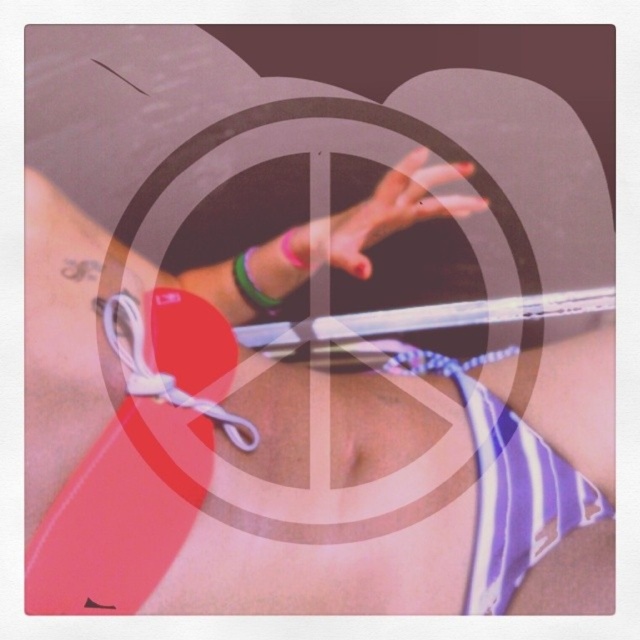
Question: Estimate the real-world distances between objects in this image. Which object is farther from the pink matte hand at center?

Choices:
 (A) striped fabric bikini top at center
 (B) green rubber bracelet at upper center
 (C) matte red surfboard at center
 (D) green rubber bracelet at center

Answer: (A)

Question: Which point appears farthest from the camera in this image?

Choices:
 (A) (264, 314)
 (B) (112, 296)

Answer: (A)

Question: Is striped fabric bikini top at center further to the viewer compared to pink matte hand at center?

Choices:
 (A) yes
 (B) no

Answer: (B)

Question: Which object is farther from the camera taking this photo?

Choices:
 (A) white fabric strap at center
 (B) green rubber bracelet at upper center

Answer: (B)

Question: Does matte red surfboard at center come in front of pink matte hand at center?

Choices:
 (A) no
 (B) yes

Answer: (B)

Question: From the image, what is the correct spatial relationship of pink matte hand at center in relation to green rubber bracelet at center?

Choices:
 (A) left
 (B) right

Answer: (B)